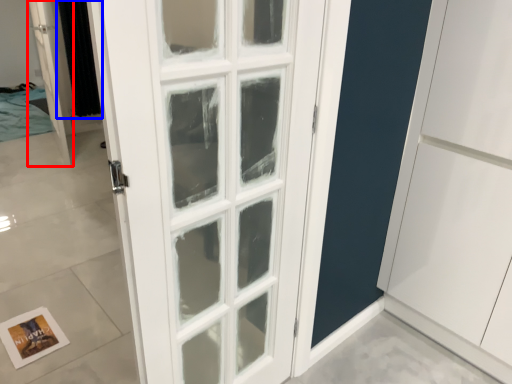
Question: Among these objects, which one is nearest to the camera, door (highlighted by a red box) or curtain (highlighted by a blue box)?

Choices:
 (A) door
 (B) curtain

Answer: (A)